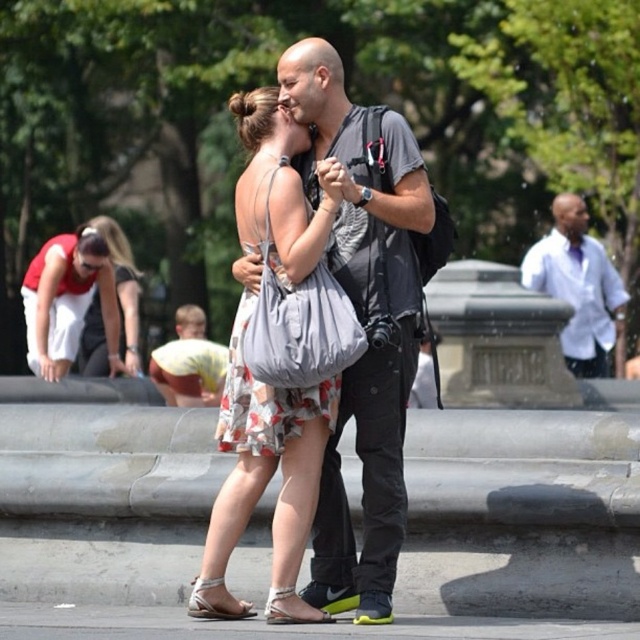
You are a photographer trying to capture a clear shot of the two main subjects in the scene. You notice a white cotton shirt at right and a white fabric sandal at lower center. Which object is positioned higher in the frame?

The white cotton shirt at right is above the white fabric sandal at lower center, so it is positioned higher in the frame.

You are standing at the center of the scene and want to take a photo of both the white cotton shirt at right and the white fabric sandal at lower center. Do you think you can capture both in a single frame without moving your camera? Please explain your reasoning.

The white cotton shirt at right is 143.32 feet away from the white fabric sandal at lower center. Since the distance between them is quite large, it might be challenging to capture both in a single frame without moving the camera. However, using a wide angle lens could potentially include both subjects in the shot.